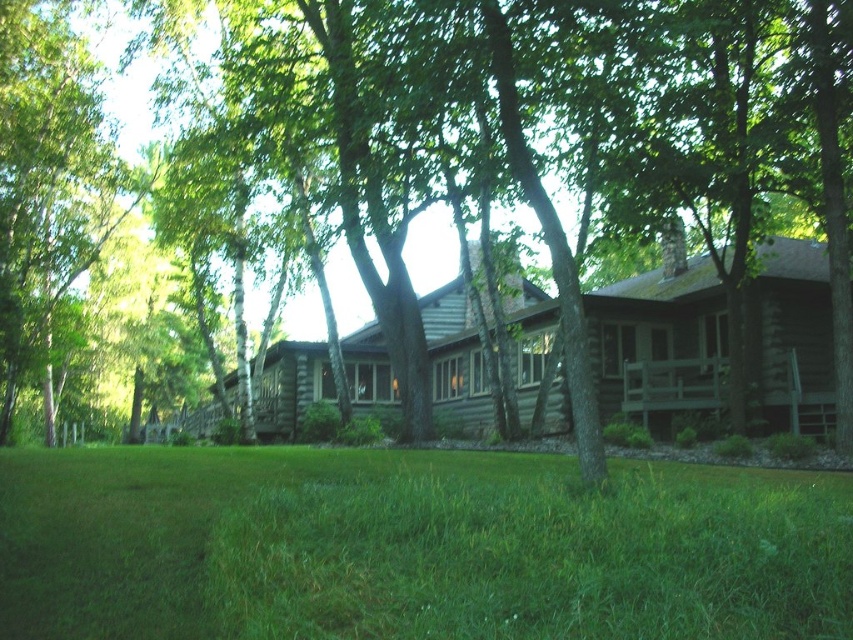
You are standing at the origin point in the image. Where is the green grass at lower center located in 2D coordinates?

The green grass at lower center is located at 2D coordinates point (413,547).